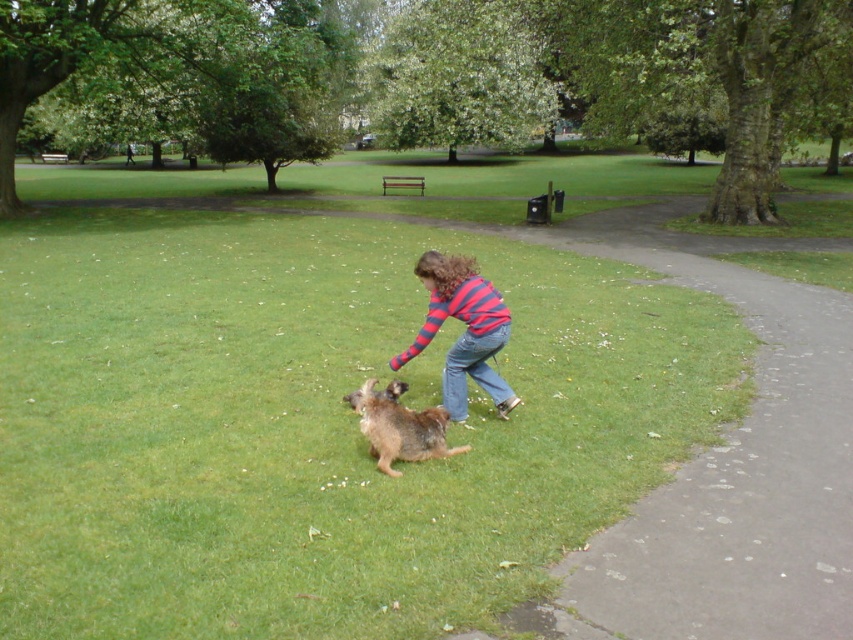
Question: Considering the relative positions of striped cotton shirt at center and brown shaggy dog at center in the image provided, where is striped cotton shirt at center located with respect to brown shaggy dog at center?

Choices:
 (A) left
 (B) right

Answer: (B)

Question: Which of the following is the farthest from the observer?

Choices:
 (A) striped cotton shirt at center
 (B) brown shaggy dog at center

Answer: (A)

Question: Does striped cotton shirt at center have a larger size compared to brown shaggy dog at center?

Choices:
 (A) no
 (B) yes

Answer: (B)

Question: Is striped cotton shirt at center behind brown shaggy dog at center?

Choices:
 (A) no
 (B) yes

Answer: (B)